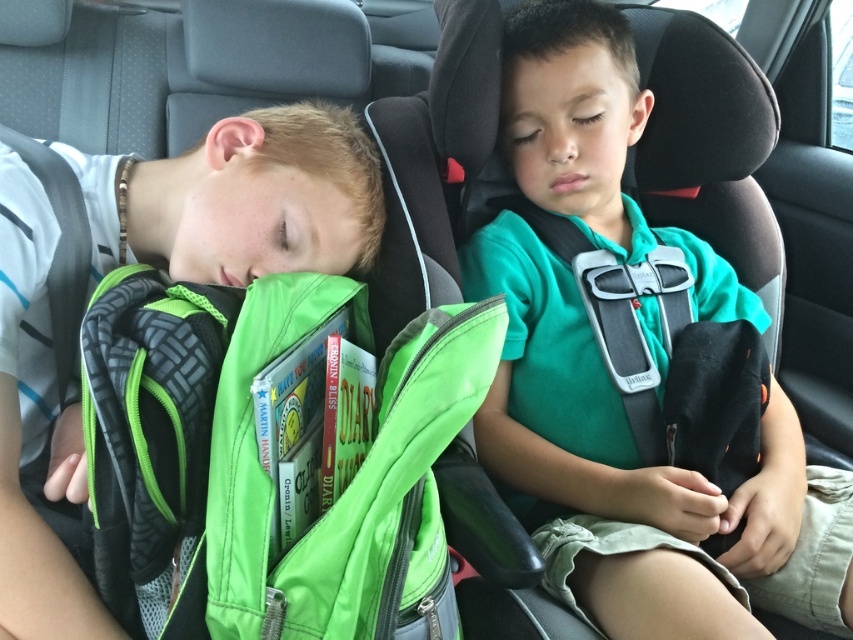
Question: Which of the following is the closest to the observer?

Choices:
 (A) (62, 371)
 (B) (637, 376)
 (C) (613, 509)
 (D) (338, 118)

Answer: (A)

Question: Does gray fabric seatbelt at center lie in front of black fabric seatbelt at left?

Choices:
 (A) yes
 (B) no

Answer: (B)

Question: Which of these objects is positioned closest to the gray fabric seatbelt at center?

Choices:
 (A) green cotton shirt at center
 (B) green fabric backpack at left
 (C) black fabric seatbelt at left

Answer: (A)

Question: Which point is farther to the camera?

Choices:
 (A) (592, 257)
 (B) (502, 461)

Answer: (A)

Question: Does gray fabric seatbelt at center have a larger size compared to black fabric seatbelt at left?

Choices:
 (A) yes
 (B) no

Answer: (A)

Question: Can you confirm if green cotton shirt at center is thinner than green fabric backpack at left?

Choices:
 (A) yes
 (B) no

Answer: (B)